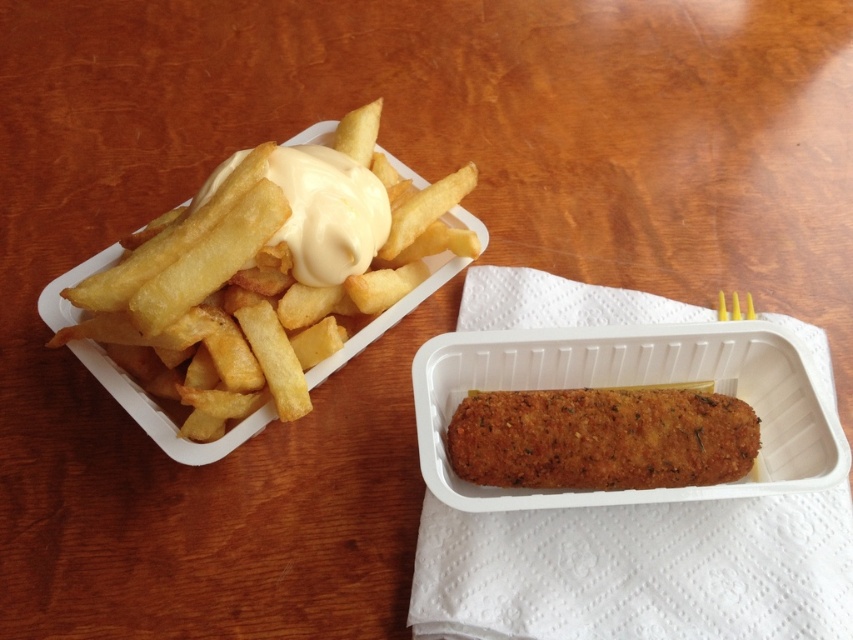
You are a food delivery person who needs to pack these items into a box. The box can only fit items that are wider than 10 cm. Based on the scene, can you confirm if both the golden crispy french fries at left and the golden crispy croquette at center will fit in the box?

The golden crispy french fries at left is wider than the golden crispy croquette at center. Since the box requires items wider than 10 cm, we need to know the exact width of the narrower item. However, the description only states the relative sizes between them. Without specific measurements, we cannot confirm if both meet the 10 cm requirement.

You are a food delivery person who needs to stack the golden crispy french fries at left and the golden crispy croquette at center into a single container. Which one should you place at the bottom to ensure the top item doesn

The golden crispy french fries at left has a greater height compared to the golden crispy croquette at center. Therefore, you should place the golden crispy croquette at center at the bottom and the golden crispy french fries at left on top to maintain stability.

You are a food delivery person who needs to hand over the meal to the customer. You see the golden crispy french fries at left and the golden crispy croquette at center. Which one is closer to you?

The golden crispy french fries at left is closer to you because it is in front of the golden crispy croquette at center.